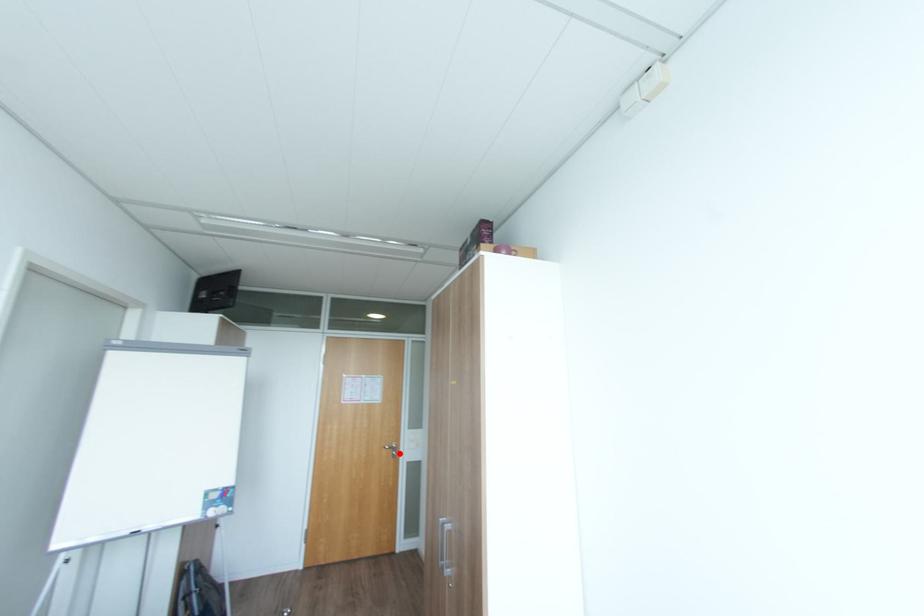
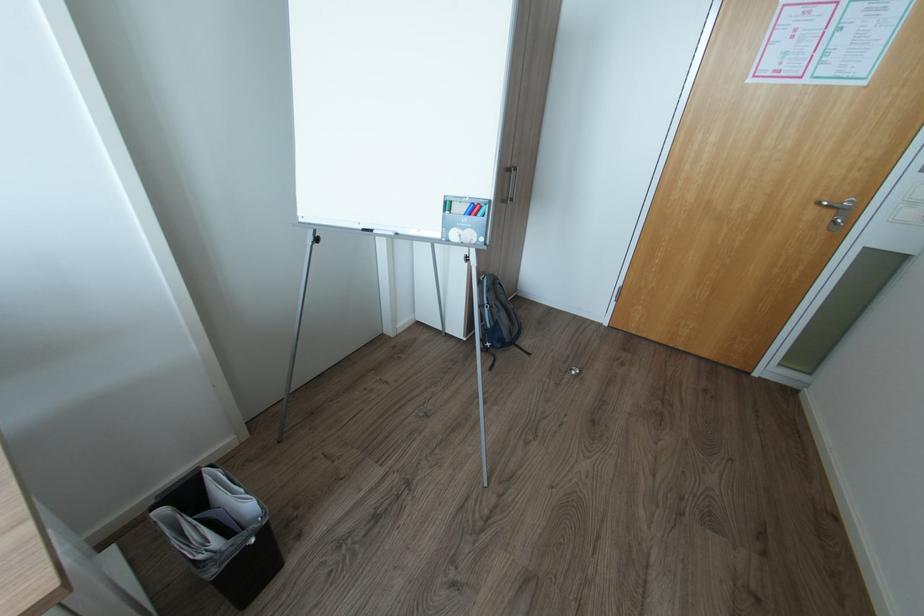
Find the pixel in the second image that matches the highlighted location in the first image.

(845, 221)